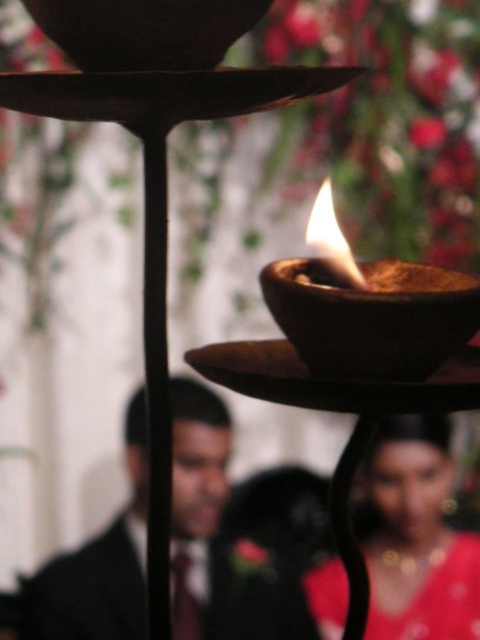
Question: Does matte brown bowl at center have a greater width compared to flame wick at center?

Choices:
 (A) yes
 (B) no

Answer: (A)

Question: Which is nearer to the matte red dress at center?

Choices:
 (A) flame wick at center
 (B) dark suit at center

Answer: (B)

Question: Is wooden candle holder at center to the right of flame wick at center from the viewer's perspective?

Choices:
 (A) no
 (B) yes

Answer: (B)

Question: Can you confirm if dark suit at center is positioned to the left of flame wick at center?

Choices:
 (A) no
 (B) yes

Answer: (B)

Question: Considering the real-world distances, which object is farthest from the matte red dress at center?

Choices:
 (A) wooden candle holder at center
 (B) matte brown bowl at center
 (C) flame wick at center
 (D) wooden bowl at center

Answer: (C)

Question: Which point is closer to the camera taking this photo?

Choices:
 (A) (331, 237)
 (B) (458, 410)
 (C) (451, 484)

Answer: (B)